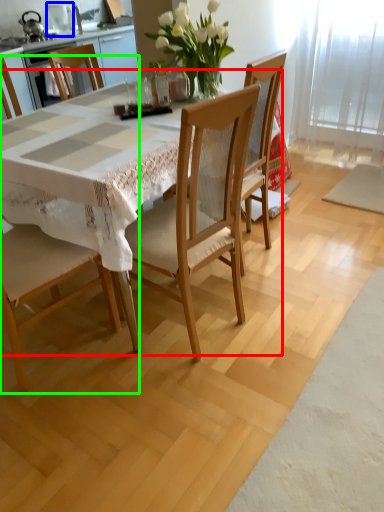
Question: Based on their relative distances, which object is nearer to round table (highlighted by a red box)? Choose from appliance (highlighted by a blue box) and chair (highlighted by a green box).

Choices:
 (A) appliance
 (B) chair

Answer: (B)